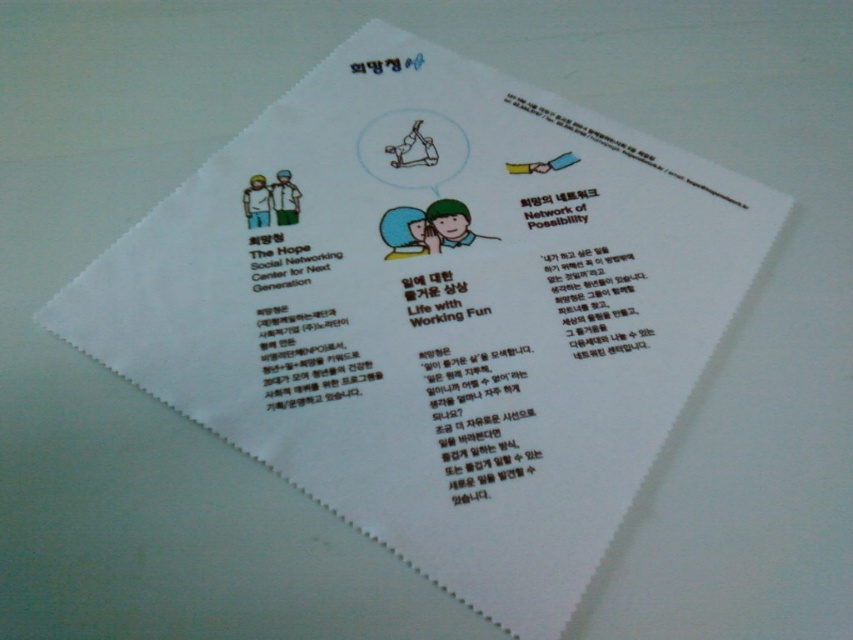
You are organizing documents on a desk and see the white paper at upper right and the black paper network of possibility at upper center. Which paper is located more to the right side?

The white paper at upper right is positioned on the right side of black paper network of possibility at upper center, so it is more to the right.